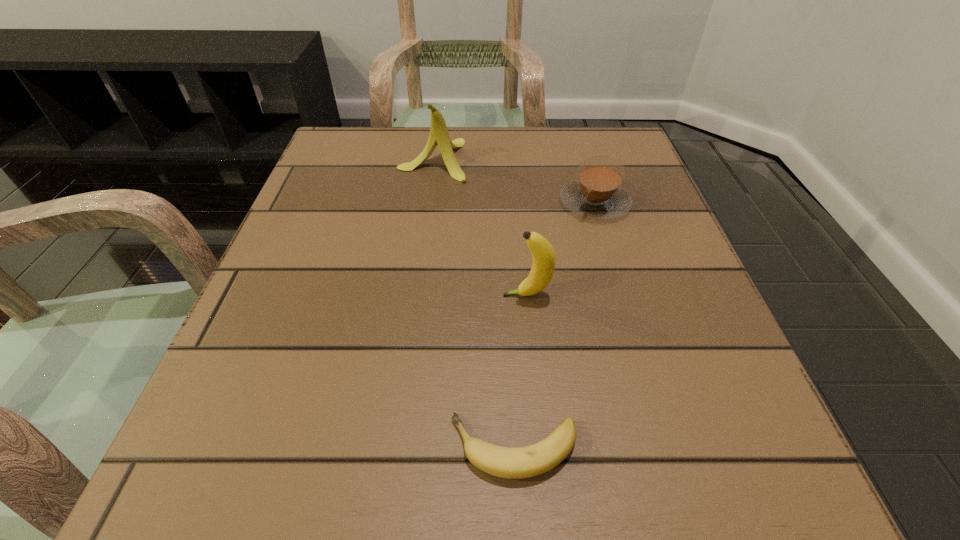
This screenshot has height=540, width=960. I want to click on the farthest banana, so click(x=439, y=135).

Where is `the third farthest object`? the third farthest object is located at coordinates (543, 254).

Locate an element on the screen. The width and height of the screenshot is (960, 540). the second shortest object is located at coordinates (597, 194).

Where is `the rightmost object`? the rightmost object is located at coordinates (597, 194).

The height and width of the screenshot is (540, 960). Find the location of `the nearest object`. the nearest object is located at coordinates (506, 462).

At what (x,y) coordinates should I click in order to perform the action: click on the shortest object. Please return your answer as a coordinate pair (x, y). Image resolution: width=960 pixels, height=540 pixels. Looking at the image, I should click on (506, 462).

You are a GUI agent. You are given a task and a screenshot of the screen. Output one action in this format:
    pyautogui.click(x=<x>, y=<y>)
    Task: Click on the free point located 0.290m on the front of the farthest banana
    The width and height of the screenshot is (960, 540).
    Given the screenshot: What is the action you would take?
    pyautogui.click(x=416, y=287)

Where is `vacant region located 0.320m from the stem of the second nearest object`? This screenshot has width=960, height=540. vacant region located 0.320m from the stem of the second nearest object is located at coordinates (300, 295).

The image size is (960, 540). I want to click on vacant space located 0.110m from the stem of the second nearest object, so click(434, 295).

Locate an element on the screen. This screenshot has height=540, width=960. vacant region located from the stem of the second nearest object is located at coordinates (307, 295).